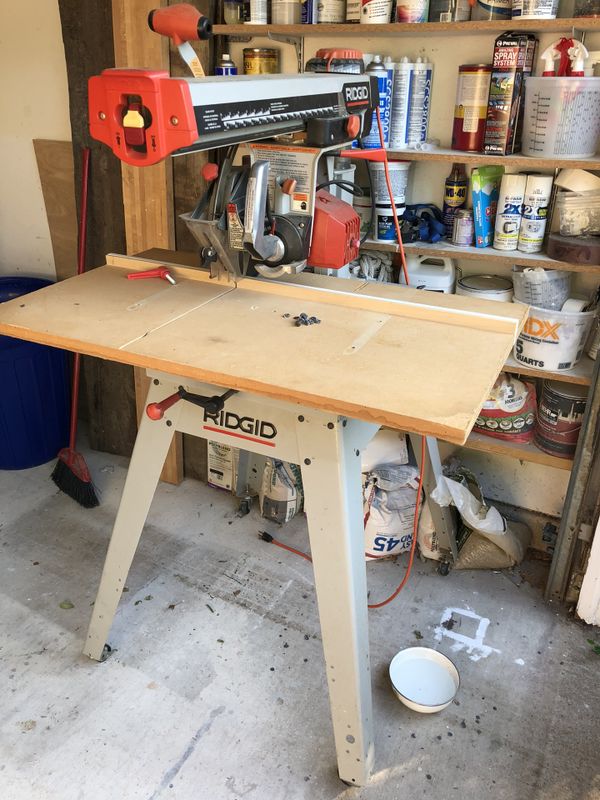
At what (x,y) coordinates should I click in order to perform the action: click on bowl of clear liquid. Please return your answer as a coordinate pair (x, y). The width and height of the screenshot is (600, 800). Looking at the image, I should click on (417, 685).